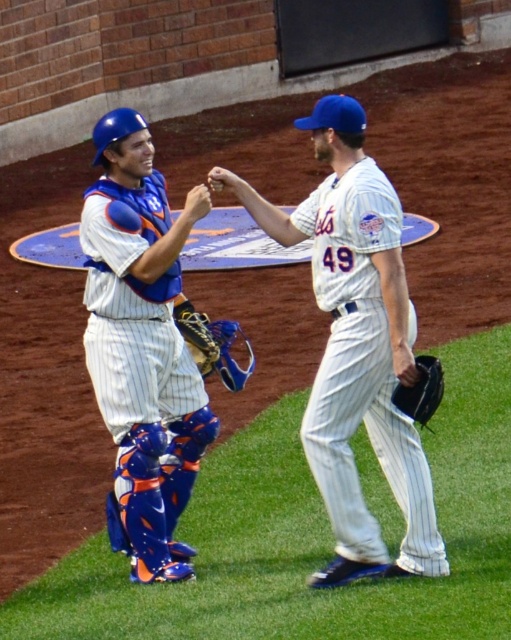
Question: Observing the image, what is the correct spatial positioning of white pinstriped uniform at center in reference to black leather baseball glove at right?

Choices:
 (A) above
 (B) below

Answer: (A)

Question: Can you confirm if white pinstriped uniform at left is smaller than leather textured glove at center?

Choices:
 (A) yes
 (B) no

Answer: (B)

Question: Which of these objects is positioned closest to the black leather baseball glove at right?

Choices:
 (A) leather textured glove at center
 (B) white pinstriped uniform at left
 (C) white pinstriped uniform at center

Answer: (C)

Question: Can you confirm if white pinstriped uniform at left is positioned above black leather baseball glove at right?

Choices:
 (A) no
 (B) yes

Answer: (B)

Question: Which point is farther to the camera?

Choices:
 (A) white pinstriped uniform at left
 (B) white pinstriped uniform at center
 (C) leather textured glove at center

Answer: (C)

Question: Which point is farther from the camera taking this photo?

Choices:
 (A) (340, 442)
 (B) (198, 346)
 (C) (435, 388)

Answer: (B)